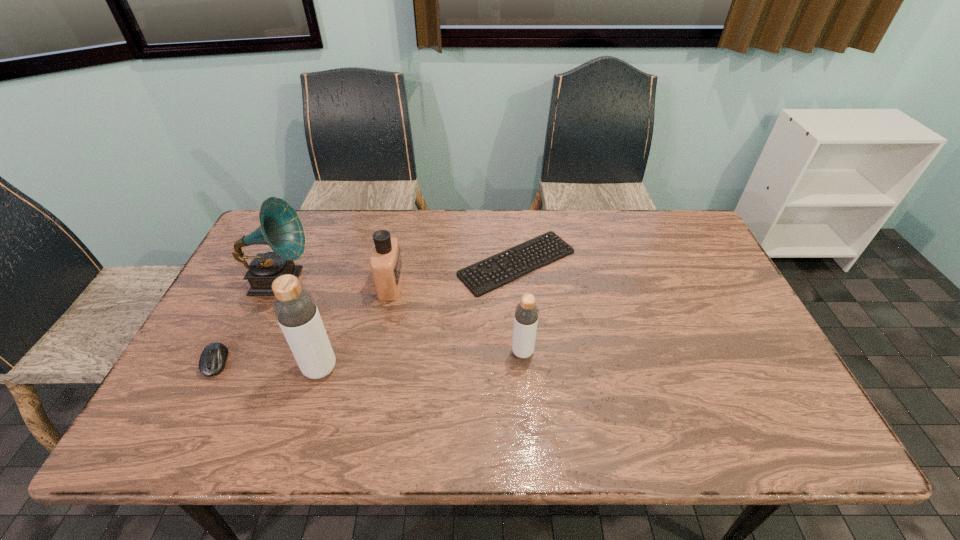
Locate an element on the screen. Image resolution: width=960 pixels, height=540 pixels. the third object from left to right is located at coordinates (294, 307).

At what (x,y) coordinates should I click in order to perform the action: click on the taller bottle. Please return your answer as a coordinate pair (x, y). Looking at the image, I should click on (294, 307).

Image resolution: width=960 pixels, height=540 pixels. What are the coordinates of `the right bottle` in the screenshot? It's located at (526, 316).

This screenshot has height=540, width=960. Identify the location of the third object from right to left. (386, 265).

Locate an element on the screen. The image size is (960, 540). the shortest object is located at coordinates (550, 245).

Where is `phonograph_record`? The image size is (960, 540). phonograph_record is located at coordinates (280, 227).

Locate an element on the screen. This screenshot has height=540, width=960. the second shortest object is located at coordinates (212, 361).

The height and width of the screenshot is (540, 960). What are the coordinates of `free region located on the back of the taller bottle` in the screenshot? It's located at (342, 297).

Locate an element on the screen. free region located 0.400m on the left of the shorter bottle is located at coordinates (355, 352).

Image resolution: width=960 pixels, height=540 pixels. Identify the location of vacant space located on the front label of the third object from right to left. (487, 285).